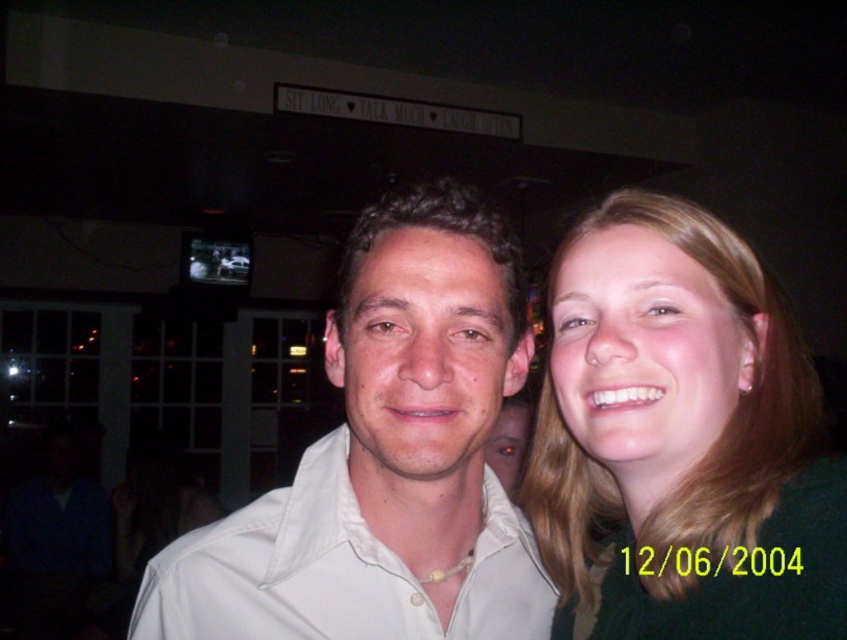
You are standing in the room and want to place a small decorative item on the nearest point between point (x=734, y=596) and point (x=377, y=227). Which point should you choose?

Point (x=734, y=596) is closer to the viewer than point (x=377, y=227), so you should choose point (x=734, y=596) to place the decorative item.

Consider the image. You are a photographer standing at the back of the room. You want to take a photo of both the white matte shirt at center and the white satin shirt at center without any overlap. Given that your camera has a maximum focus range of 1.5 inches, can you capture both shirts in the same frame without moving closer?

The distance between the white matte shirt at center and the white satin shirt at center is 1.84 inches. Since the camera can only focus up to 1.5 inches, the shirts are too far apart to be captured without overlap in the same frame without moving closer.

You are a photographer trying to adjust the lighting for a group photo. You notice the blonde hair at center and the white matte shirt at center. Which object is located to the right of the other?

The blonde hair at center is positioned on the right side of white matte shirt at center.